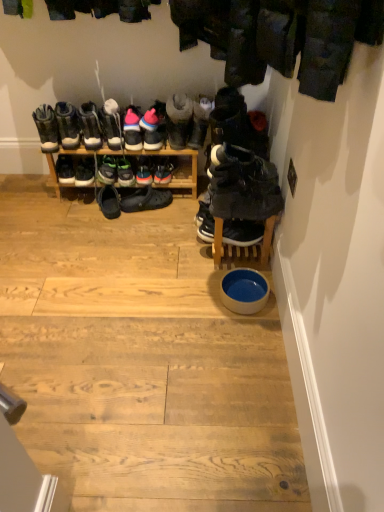
Question: Which direction should I rotate to look at white suede sneakers at center, the 12th footwear in the right-to-left sequence, — up or down?

Choices:
 (A) down
 (B) up

Answer: (B)

Question: Is green matte sneakers at center, which is the 4th footwear in left-to-right order, positioned before suede sneakers at center, marked as the fifth footwear in a right-to-left arrangement?

Choices:
 (A) no
 (B) yes

Answer: (A)

Question: Does green matte sneakers at center, the thirteenth footwear in the right-to-left sequence, appear on the right side of suede sneakers at center, marked as the fifth footwear in a right-to-left arrangement?

Choices:
 (A) no
 (B) yes

Answer: (A)

Question: Is green matte sneakers at center, which is the 4th footwear in left-to-right order, not within suede sneakers at center, marked as the fifth footwear in a right-to-left arrangement?

Choices:
 (A) yes
 (B) no

Answer: (A)

Question: Does green matte sneakers at center, which is the 4th footwear in left-to-right order, turn towards suede sneakers at center, which is counted as the 12th footwear, starting from the left?

Choices:
 (A) no
 (B) yes

Answer: (A)

Question: Is green matte sneakers at center, which is the 4th footwear in left-to-right order, further to camera compared to suede sneakers at center, which is counted as the 12th footwear, starting from the left?

Choices:
 (A) no
 (B) yes

Answer: (B)

Question: Can you confirm if green matte sneakers at center, the thirteenth footwear in the right-to-left sequence, is smaller than suede sneakers at center, which is counted as the 12th footwear, starting from the left?

Choices:
 (A) yes
 (B) no

Answer: (A)

Question: From the image's perspective, would you say matte black boot at left, marked as the first footwear in a left-to-right arrangement, is shown under pink suede sneakers at center, placed as the seventh footwear when sorted from right to left?

Choices:
 (A) no
 (B) yes

Answer: (B)

Question: From the image's perspective, does matte black boot at left, positioned as the sixteenth footwear in right-to-left order, appear higher than pink suede sneakers at center, the 10th footwear from the left?

Choices:
 (A) no
 (B) yes

Answer: (A)

Question: Is matte black boot at left, positioned as the sixteenth footwear in right-to-left order, at the left side of pink suede sneakers at center, placed as the seventh footwear when sorted from right to left?

Choices:
 (A) no
 (B) yes

Answer: (B)

Question: Would you say pink suede sneakers at center, the 10th footwear from the left, is part of matte black boot at left, marked as the first footwear in a left-to-right arrangement,'s contents?

Choices:
 (A) yes
 (B) no

Answer: (B)

Question: Does matte black boot at left, marked as the first footwear in a left-to-right arrangement, have a greater width compared to pink suede sneakers at center, placed as the seventh footwear when sorted from right to left?

Choices:
 (A) no
 (B) yes

Answer: (A)

Question: Does matte black boot at left, marked as the first footwear in a left-to-right arrangement, have a greater height compared to pink suede sneakers at center, the 10th footwear from the left?

Choices:
 (A) yes
 (B) no

Answer: (A)

Question: Can you confirm if black rubber shoes at center, which is counted as the ninth footwear, starting from the right, is wider than green suede sneakers at center, the eleventh footwear viewed from the right?

Choices:
 (A) no
 (B) yes

Answer: (A)